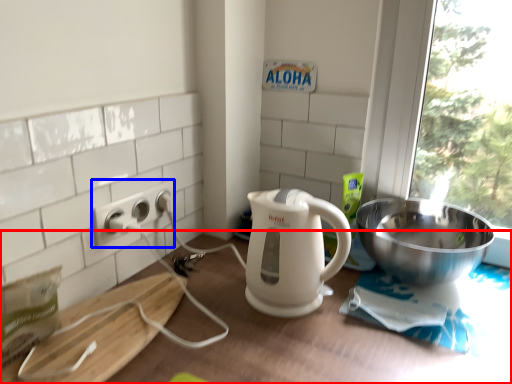
Question: Which point is closer to the camera, table (highlighted by a red box) or power outlet (highlighted by a blue box)?

Choices:
 (A) table
 (B) power outlet

Answer: (A)